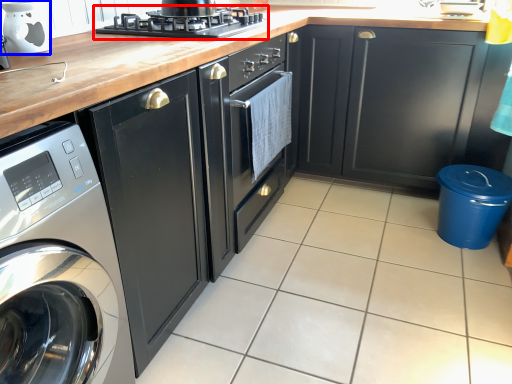
Question: Which object appears farthest to the camera in this image, kitchen appliance (highlighted by a red box) or appliance (highlighted by a blue box)?

Choices:
 (A) kitchen appliance
 (B) appliance

Answer: (A)